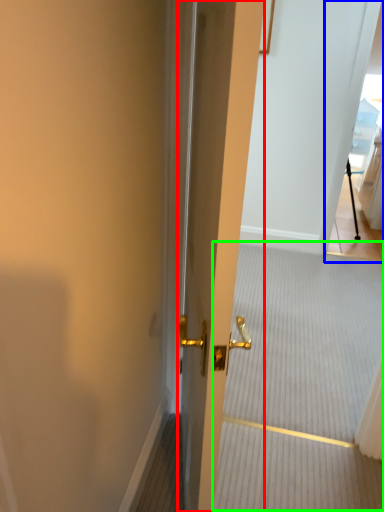
Question: Which object is the closest to the door (highlighted by a red box)? Choose among these: glass door (highlighted by a blue box) or stair (highlighted by a green box).

Choices:
 (A) glass door
 (B) stair

Answer: (B)